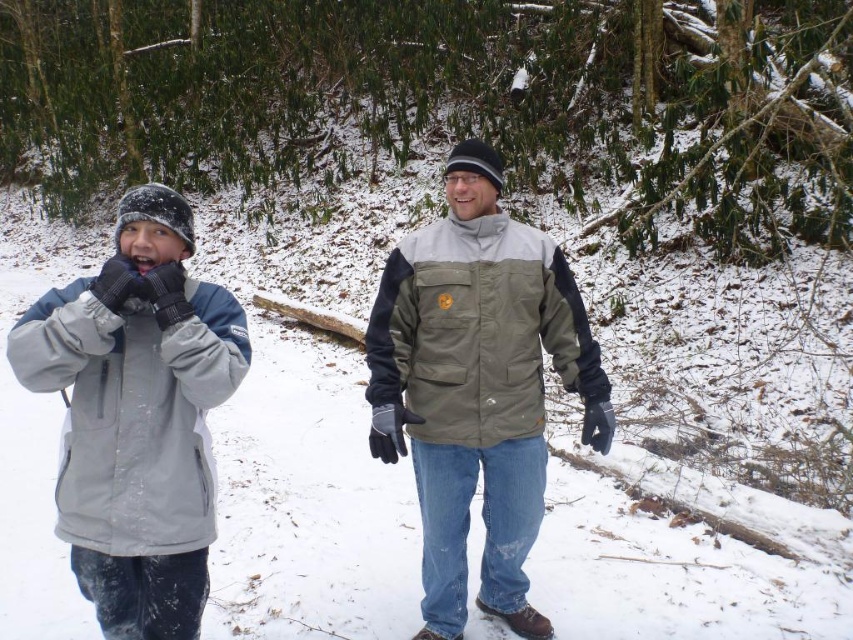
Please provide the coordinates of the matte gray jacket at center in the image. The coordinates should be in the format of a point with two decimal places, such as 0.500, 0.500.

The coordinates of the matte gray jacket at center are at point (477, 387).

You are navigating a snowy path and need to reach a destination marked by point (115,602). There is an obstacle at point (521,356) that you must avoid. Which direction should you move relative to the obstacle to reach your destination safely?

Since point (521,356) is closer to you than point (115,602), you should move away from the obstacle towards the destination by going around it in the direction away from your current position.